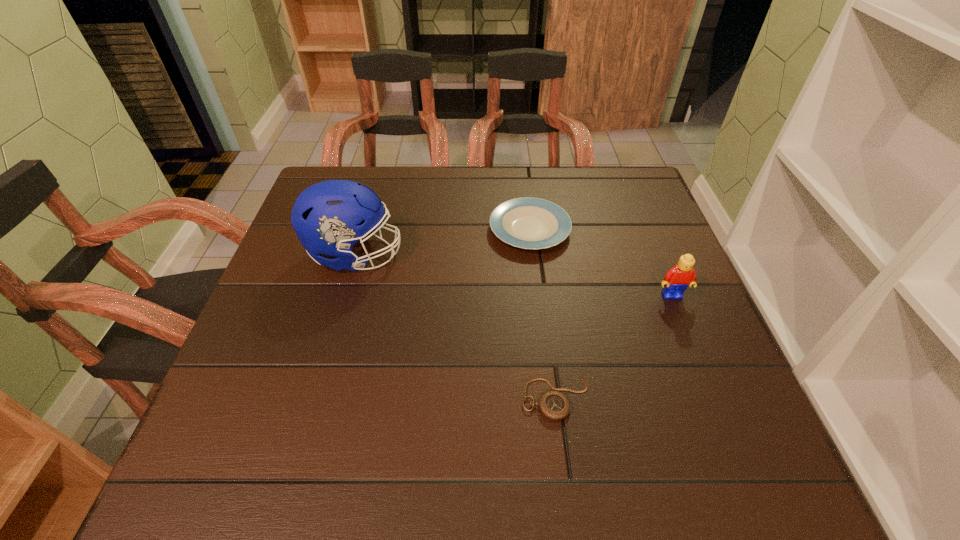
Locate an element on the screen. vacant space that satisfies the following two spatial constraints: 1. on the face guard of the pocket watch; 2. on the right side of the tallest object is located at coordinates (315, 397).

You are a GUI agent. You are given a task and a screenshot of the screen. Output one action in this format:
    pyautogui.click(x=<x>, y=<y>)
    Task: Click on the free space that satisfies the following two spatial constraints: 1. on the face guard of the tallest object; 2. on the left side of the nearest object
    This screenshot has width=960, height=540.
    Given the screenshot: What is the action you would take?
    pyautogui.click(x=315, y=397)